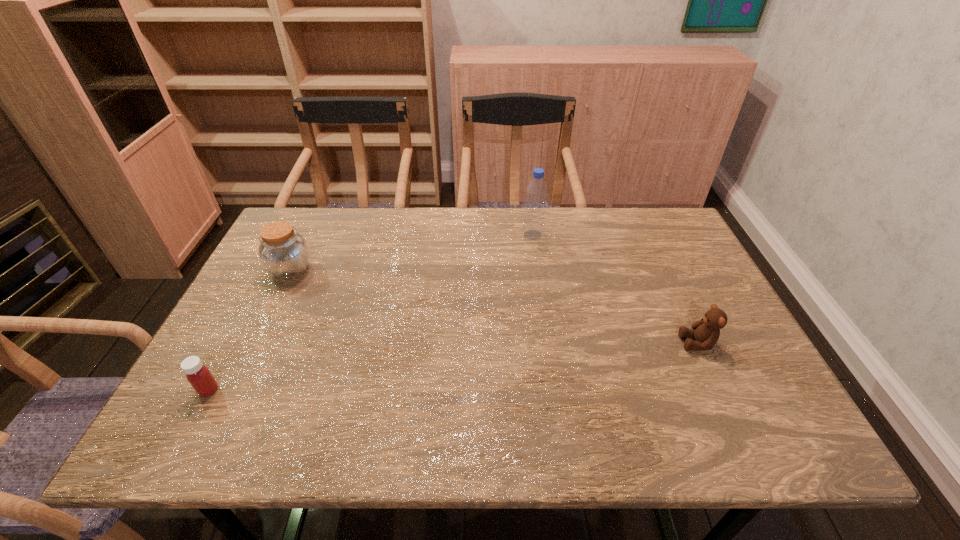
Locate an element on the screen. the second object from right to left is located at coordinates (533, 226).

Image resolution: width=960 pixels, height=540 pixels. What are the coordinates of `bottle` in the screenshot? It's located at (533, 226).

This screenshot has width=960, height=540. Find the location of `jar`. jar is located at coordinates (284, 253).

Find the location of a particular element. the third nearest object is located at coordinates (x=284, y=253).

This screenshot has height=540, width=960. What are the coordinates of `teddy bear` in the screenshot? It's located at (706, 332).

At what (x,y) coordinates should I click in order to perform the action: click on the third farthest object. Please return your answer as a coordinate pair (x, y). This screenshot has width=960, height=540. Looking at the image, I should click on 706,332.

At what (x,y) coordinates should I click in order to perform the action: click on medicine. Please return your answer as a coordinate pair (x, y). Looking at the image, I should click on (198, 375).

The width and height of the screenshot is (960, 540). Identify the location of vacant region located 0.220m on the left of the bottle. (450, 235).

Identify the location of free space located 0.260m on the right of the second tallest object. (406, 270).

What are the coordinates of `vacant area situated 0.370m on the face of the second nearest object` in the screenshot? It's located at (525, 343).